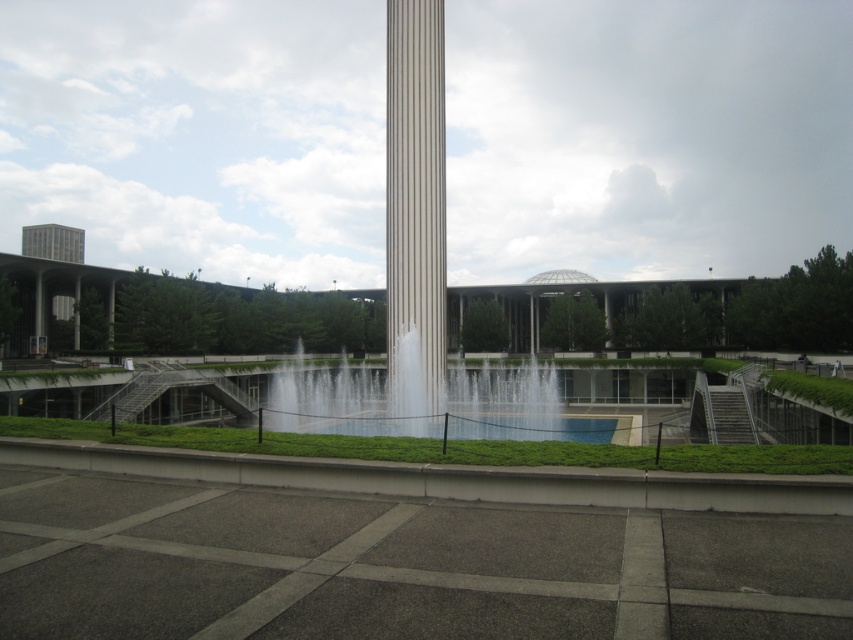
In the scene shown: Which is above, white glossy fountain at center or clear water at center?

white glossy fountain at center is higher up.

Is point (550, 432) farther from viewer compared to point (302, 400)?

No, (550, 432) is closer to viewer.

Image resolution: width=853 pixels, height=640 pixels. I want to click on white glossy fountain at center, so click(419, 289).

Find the location of a particular element. The width and height of the screenshot is (853, 640). white glossy fountain at center is located at coordinates (419, 289).

Can you confirm if white glossy fountain at center is thinner than gray concrete tower at upper left?

Correct, white glossy fountain at center's width is less than gray concrete tower at upper left's.

Between point (440, 221) and point (22, 236), which one is positioned behind?

The point (22, 236) is more distant.

You are a GUI agent. You are given a task and a screenshot of the screen. Output one action in this format:
    pyautogui.click(x=<x>, y=<y>)
    Task: Click on the white glossy fountain at center
    
    Given the screenshot: What is the action you would take?
    (419, 289)

Between clear water at center and gray concrete tower at upper left, which one is positioned lower?

clear water at center is lower down.

Can you confirm if clear water at center is thinner than gray concrete tower at upper left?

Yes.

What do you see at coordinates (416, 401) in the screenshot? I see `clear water at center` at bounding box center [416, 401].

At what (x,y) coordinates should I click in order to perform the action: click on clear water at center. Please return your answer as a coordinate pair (x, y). Looking at the image, I should click on (416, 401).